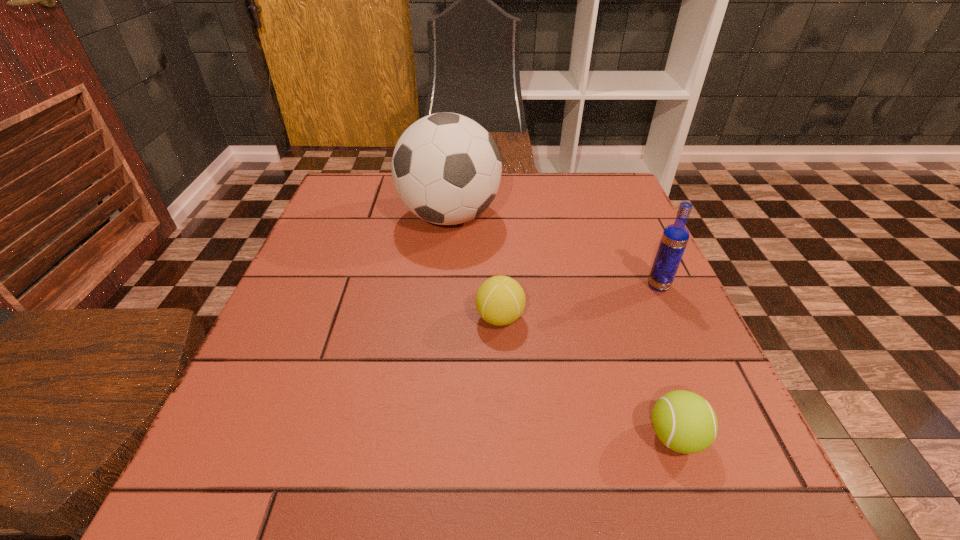
Image resolution: width=960 pixels, height=540 pixels. Find the location of `the farthest object`. the farthest object is located at coordinates (446, 168).

At what (x,y) coordinates should I click in order to perform the action: click on soccer ball. Please return your answer as a coordinate pair (x, y). This screenshot has height=540, width=960. Looking at the image, I should click on (446, 168).

Locate an element on the screen. the third shortest object is located at coordinates (675, 237).

Where is `the rightmost object`? the rightmost object is located at coordinates (675, 237).

Locate an element on the screen. the farther tennis ball is located at coordinates (500, 300).

Identify the location of the second nearest object. The height and width of the screenshot is (540, 960). (500, 300).

Find the location of a particular element. Image resolution: width=960 pixels, height=540 pixels. the nearest object is located at coordinates (685, 422).

At what (x,y) coordinates should I click in order to perform the action: click on the nearer tennis ball. Please return your answer as a coordinate pair (x, y). The width and height of the screenshot is (960, 540). Looking at the image, I should click on (685, 422).

Where is `vacant space located on the right of the tallest object`? vacant space located on the right of the tallest object is located at coordinates (543, 217).

Find the location of `vacant space located 0.400m on the front of the rightmost object`. vacant space located 0.400m on the front of the rightmost object is located at coordinates (755, 496).